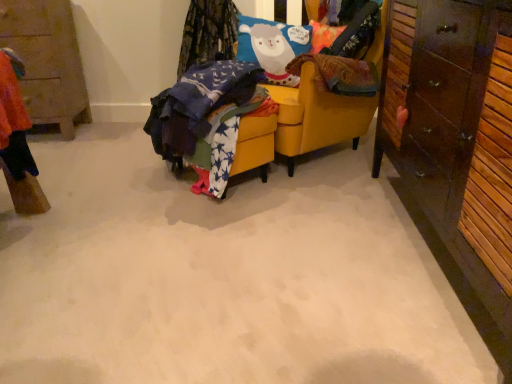
In order to face star-patterned fabric at center, should I rotate leftwards or rightwards?

Rotate left and turn 4.644 degrees.

Locate an element on the screen. This screenshot has height=384, width=512. wooden cabinet at left, which ranks as the 2th cabinetry in front-to-back order is located at coordinates [x=47, y=61].

Find the location of a particular element. yellow fabric chair at center is located at coordinates (317, 116).

Image resolution: width=512 pixels, height=384 pixels. I want to click on dark brown wood cabinet at right, which is the 2th cabinetry in left-to-right order, so click(x=456, y=137).

Considering the sizes of yellow fabric chair at center and star-patterned fabric at center in the image, is yellow fabric chair at center wider or thinner than star-patterned fabric at center?

Considering their sizes, yellow fabric chair at center looks broader than star-patterned fabric at center.

Which object is more forward, yellow fabric chair at center or star-patterned fabric at center?

yellow fabric chair at center is more forward.

Is yellow fabric chair at center outside of star-patterned fabric at center?

yellow fabric chair at center is positioned outside star-patterned fabric at center.

Is yellow fabric chair at center oriented towards star-patterned fabric at center?

Yes, yellow fabric chair at center is turned towards star-patterned fabric at center.

Are star-patterned fabric at center and wooden cabinet at left, which appears as the second cabinetry when viewed from the right, making contact?

star-patterned fabric at center and wooden cabinet at left, which appears as the second cabinetry when viewed from the right, are not in contact.

Does star-patterned fabric at center lie behind wooden cabinet at left, which appears as the first cabinetry when viewed from the back?

That is False.

From a real-world perspective, who is located lower, star-patterned fabric at center or wooden cabinet at left, which appears as the second cabinetry when viewed from the right?

star-patterned fabric at center.

Is point (200, 89) farther from viewer compared to point (37, 15)?

No, it is in front of (37, 15).

Is point (383, 152) closer or farther from the camera than point (223, 96)?

Point (383, 152) is farther from the camera than point (223, 96).

Is dark brown wood cabinet at right, acting as the second cabinetry starting from the back, bigger than star-patterned fabric at center?

Yes.

In the scene shown: From the image's perspective, which one is positioned higher, dark brown wood cabinet at right, which is the 2th cabinetry in left-to-right order, or star-patterned fabric at center?

star-patterned fabric at center.

How many degrees apart are the facing directions of star-patterned fabric at center and dark brown wood cabinet at right, which is the 2th cabinetry in left-to-right order?

There is a 38-degree angle between the facing directions of star-patterned fabric at center and dark brown wood cabinet at right, which is the 2th cabinetry in left-to-right order.

Are star-patterned fabric at center and dark brown wood cabinet at right, the first cabinetry positioned from the front, located far from each other?

No, star-patterned fabric at center is not far from dark brown wood cabinet at right, the first cabinetry positioned from the front.

Who is taller, star-patterned fabric at center or dark brown wood cabinet at right, acting as the second cabinetry starting from the back?

dark brown wood cabinet at right, acting as the second cabinetry starting from the back.

From a real-world perspective, is star-patterned fabric at center on dark brown wood cabinet at right, the first cabinetry positioned from the front?

No, from a real-world perspective, star-patterned fabric at center is not on top of dark brown wood cabinet at right, the first cabinetry positioned from the front.

What's the angular difference between star-patterned fabric at center and yellow fabric chair at center's facing directions?

The angular difference between star-patterned fabric at center and yellow fabric chair at center is 2.83 degrees.

Is star-patterned fabric at center located outside yellow fabric chair at center?

star-patterned fabric at center lies outside yellow fabric chair at center's area.

Is yellow fabric chair at center at the back of star-patterned fabric at center?

Correct, star-patterned fabric at center is looking away from yellow fabric chair at center.

From a real-world perspective, is star-patterned fabric at center located beneath yellow fabric chair at center?

Yes, from a real-world perspective, star-patterned fabric at center is under yellow fabric chair at center.

The height and width of the screenshot is (384, 512). In order to click on cabinetry above the yellow fabric chair at center (from the image's perspective) in this screenshot , I will do pos(47,61).

Considering the sizes of objects wooden cabinet at left, the 1th cabinetry when ordered from left to right, and yellow fabric chair at center in the image provided, who is bigger, wooden cabinet at left, the 1th cabinetry when ordered from left to right, or yellow fabric chair at center?

With larger size is yellow fabric chair at center.

Does wooden cabinet at left, which ranks as the 2th cabinetry in front-to-back order, have a lesser height compared to yellow fabric chair at center?

Yes.

Which object is closer to the camera, wooden cabinet at left, which appears as the second cabinetry when viewed from the right, or yellow fabric chair at center?

yellow fabric chair at center is more forward.

Could you tell me if yellow fabric chair at center is facing dark brown wood cabinet at right, acting as the second cabinetry starting from the back?

No, yellow fabric chair at center does not turn towards dark brown wood cabinet at right, acting as the second cabinetry starting from the back.

Considering the positions of points (334, 111) and (471, 194), is point (334, 111) farther from camera compared to point (471, 194)?

Yes, it is.

Who is shorter, yellow fabric chair at center or dark brown wood cabinet at right, acting as the second cabinetry starting from the back?

Standing shorter between the two is yellow fabric chair at center.

Locate an element on the screen. chair on the right side of star-patterned fabric at center is located at coordinates (317, 116).

Locate an element on the screen. Image resolution: width=512 pixels, height=384 pixels. clothing that is below the wooden cabinet at left, the 1th cabinetry when ordered from left to right (from the image's perspective) is located at coordinates (205, 119).

Looking at this image, looking at the image, which one is located closer to wooden cabinet at left, which ranks as the 2th cabinetry in front-to-back order, dark brown wood cabinet at right, which is counted as the 1th cabinetry, starting from the right, or yellow fabric chair at center?

→ Based on the image, yellow fabric chair at center appears to be nearer to wooden cabinet at left, which ranks as the 2th cabinetry in front-to-back order.

Considering their positions, is wooden cabinet at left, which appears as the second cabinetry when viewed from the right, positioned closer to yellow fabric chair at center than dark brown wood cabinet at right, which is the 2th cabinetry in left-to-right order?

The object closer to yellow fabric chair at center is dark brown wood cabinet at right, which is the 2th cabinetry in left-to-right order.

Considering their positions, is wooden cabinet at left, which ranks as the 2th cabinetry in front-to-back order, positioned further to star-patterned fabric at center than dark brown wood cabinet at right, acting as the second cabinetry starting from the back?

The object further to star-patterned fabric at center is wooden cabinet at left, which ranks as the 2th cabinetry in front-to-back order.

Which object lies further to the anchor point star-patterned fabric at center, wooden cabinet at left, which appears as the first cabinetry when viewed from the back, or yellow fabric chair at center?

Based on the image, wooden cabinet at left, which appears as the first cabinetry when viewed from the back, appears to be further to star-patterned fabric at center.

Considering their positions, is star-patterned fabric at center positioned closer to dark brown wood cabinet at right, which is counted as the 1th cabinetry, starting from the right, than wooden cabinet at left, the 1th cabinetry when ordered from left to right?

star-patterned fabric at center is closer to dark brown wood cabinet at right, which is counted as the 1th cabinetry, starting from the right.

Based on their spatial positions, is yellow fabric chair at center or star-patterned fabric at center closer to dark brown wood cabinet at right, the first cabinetry positioned from the front?

yellow fabric chair at center.

Estimate the real-world distances between objects in this image. Which object is closer to yellow fabric chair at center, dark brown wood cabinet at right, the first cabinetry positioned from the front, or wooden cabinet at left, which appears as the second cabinetry when viewed from the right?

dark brown wood cabinet at right, the first cabinetry positioned from the front, is closer to yellow fabric chair at center.

Considering their positions, is wooden cabinet at left, which appears as the second cabinetry when viewed from the right, positioned closer to dark brown wood cabinet at right, acting as the second cabinetry starting from the back, than yellow fabric chair at center?

yellow fabric chair at center is positioned closer to the anchor dark brown wood cabinet at right, acting as the second cabinetry starting from the back.

The image size is (512, 384). Find the location of `clothing located between wooden cabinet at left, which ranks as the 2th cabinetry in front-to-back order, and yellow fabric chair at center in the left-right direction`. clothing located between wooden cabinet at left, which ranks as the 2th cabinetry in front-to-back order, and yellow fabric chair at center in the left-right direction is located at coordinates (205, 119).

Identify the location of chair located between dark brown wood cabinet at right, acting as the second cabinetry starting from the back, and star-patterned fabric at center in the depth direction. (317, 116).

Where is `chair between wooden cabinet at left, which appears as the second cabinetry when viewed from the right, and dark brown wood cabinet at right, which is the 2th cabinetry in left-to-right order, in the horizontal direction`? This screenshot has height=384, width=512. chair between wooden cabinet at left, which appears as the second cabinetry when viewed from the right, and dark brown wood cabinet at right, which is the 2th cabinetry in left-to-right order, in the horizontal direction is located at coordinates (317, 116).

Locate an element on the screen. clothing located between wooden cabinet at left, which ranks as the 2th cabinetry in front-to-back order, and dark brown wood cabinet at right, the first cabinetry positioned from the front, in the left-right direction is located at coordinates (205, 119).